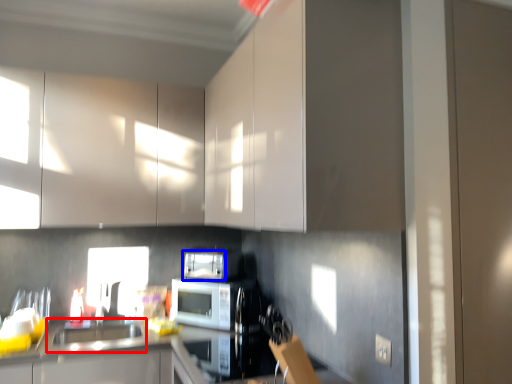
Question: Among these objects, which one is farthest to the camera, sink (highlighted by a red box) or appliance (highlighted by a blue box)?

Choices:
 (A) sink
 (B) appliance

Answer: (B)